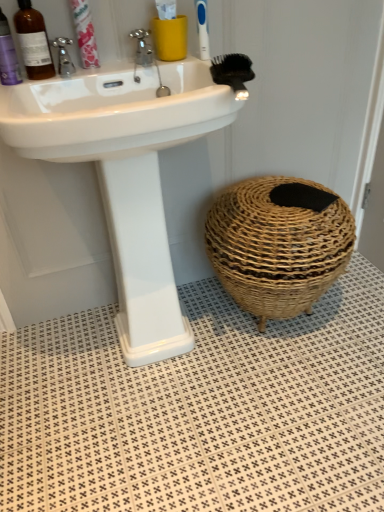
Identify the location of vacant area that is in front of braided wicker basket at lower right. This screenshot has height=512, width=384. (282, 400).